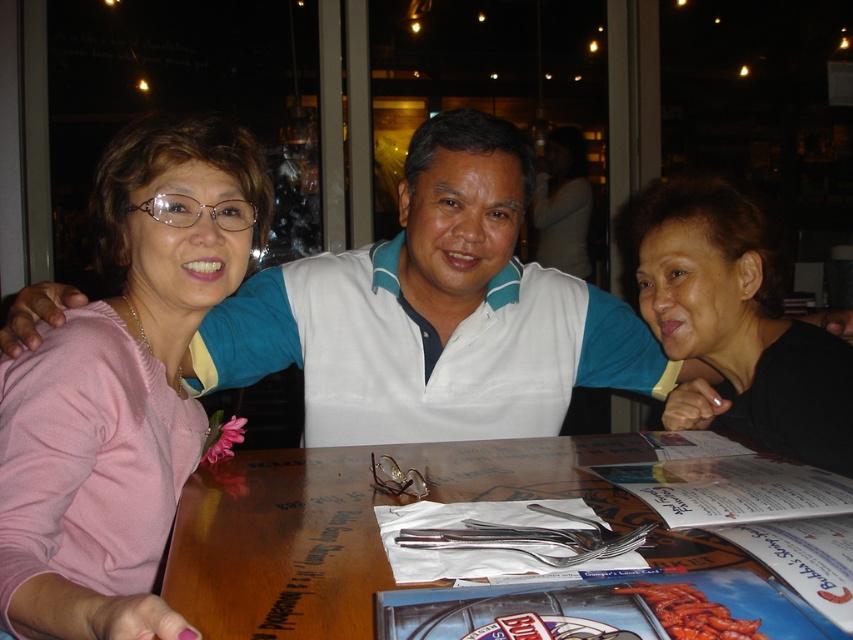
Question: Which point is closer to the camera taking this photo?

Choices:
 (A) (96, 452)
 (B) (730, 625)
 (C) (729, 243)
 (D) (532, 464)

Answer: (B)

Question: Is pink sweater at left positioned behind grilled red lobster at table center?

Choices:
 (A) no
 (B) yes

Answer: (B)

Question: Does wooden table at center appear under grilled red lobster at table center?

Choices:
 (A) yes
 (B) no

Answer: (B)

Question: Can you confirm if white smooth shirt at center is positioned above grilled red lobster at table center?

Choices:
 (A) yes
 (B) no

Answer: (A)

Question: Which object is farther from the camera taking this photo?

Choices:
 (A) pink sweater at left
 (B) black matte hair at upper right
 (C) white smooth shirt at center
 (D) wooden table at center

Answer: (C)

Question: Among these points, which one is nearest to the camera?

Choices:
 (A) (251, 205)
 (B) (746, 627)

Answer: (B)